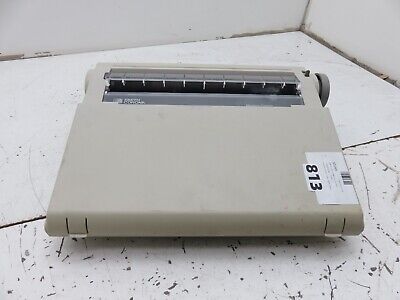
Where is `table`? table is located at coordinates (36, 177).